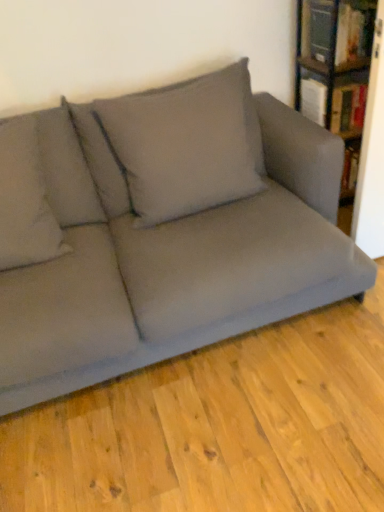
Question: Does hardcover book at upper right, which is the first book from top to bottom, have a lesser width compared to gray fabric pillow at upper center, the 2th pillow in the left-to-right sequence?

Choices:
 (A) yes
 (B) no

Answer: (A)

Question: Are hardcover book at upper right, which is the first book from top to bottom, and gray fabric pillow at upper center, the 2th pillow in the left-to-right sequence, making contact?

Choices:
 (A) yes
 (B) no

Answer: (B)

Question: Is gray fabric pillow at upper center, acting as the 1th pillow starting from the right, at the back of hardcover book at upper right, which is the 2th book in bottom-to-top order?

Choices:
 (A) no
 (B) yes

Answer: (A)

Question: Is hardcover book at upper right, which is the first book from top to bottom, not near gray fabric pillow at upper center, acting as the 1th pillow starting from the right?

Choices:
 (A) yes
 (B) no

Answer: (B)

Question: From a real-world perspective, is hardcover book at upper right, which is the 2th book in bottom-to-top order, located beneath gray fabric pillow at upper center, acting as the 1th pillow starting from the right?

Choices:
 (A) no
 (B) yes

Answer: (A)

Question: Is matte gray couch at center bigger or smaller than hardcover book at upper right, which is the 2th book in bottom-to-top order?

Choices:
 (A) big
 (B) small

Answer: (A)

Question: From a real-world perspective, is matte gray couch at center above or below hardcover book at upper right, which is the first book from top to bottom?

Choices:
 (A) above
 (B) below

Answer: (B)

Question: Does point (142, 312) appear closer or farther from the camera than point (304, 49)?

Choices:
 (A) farther
 (B) closer

Answer: (B)

Question: From the image's perspective, is matte gray couch at center positioned above or below hardcover book at upper right, which is the 2th book in bottom-to-top order?

Choices:
 (A) above
 (B) below

Answer: (B)

Question: Is matte gray couch at center to the left or to the right of gray fabric pillow at upper center, acting as the 1th pillow starting from the right, in the image?

Choices:
 (A) right
 (B) left

Answer: (B)

Question: Looking at their shapes, would you say matte gray couch at center is wider or thinner than gray fabric pillow at upper center, the 2th pillow in the left-to-right sequence?

Choices:
 (A) thin
 (B) wide

Answer: (B)

Question: Is matte gray couch at center taller or shorter than gray fabric pillow at upper center, acting as the 1th pillow starting from the right?

Choices:
 (A) short
 (B) tall

Answer: (B)

Question: Based on their sizes in the image, would you say matte gray couch at center is bigger or smaller than gray fabric pillow at upper center, acting as the 1th pillow starting from the right?

Choices:
 (A) big
 (B) small

Answer: (A)

Question: Looking at their shapes, would you say hardcover book at upper right, which is the first book from top to bottom, is wider or thinner than gray fabric pillow at upper center, the 2th pillow in the left-to-right sequence?

Choices:
 (A) wide
 (B) thin

Answer: (B)

Question: Is point (337, 40) closer or farther from the camera than point (170, 91)?

Choices:
 (A) closer
 (B) farther

Answer: (B)